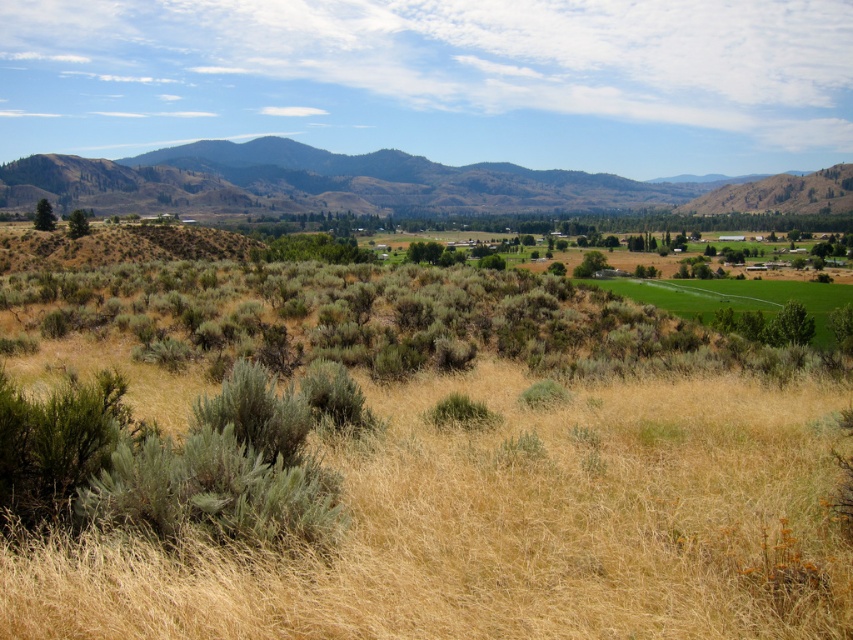
You are a hiker planning a route through the landscape shown. You need to cross from the dry grassland at center to the brown textured mountains at upper left. Which area will require more time to traverse, and why?

The brown textured mountains at upper left will require more time to traverse because they are larger in size compared to the dry grassland at center.

You are a hiker standing at the dry grassland at center and want to reach the brown textured mountains at upper left. Which direction should you head towards?

The dry grassland at center is located below the brown textured mountains at upper left, so you should head north towards the brown textured mountains at upper left.